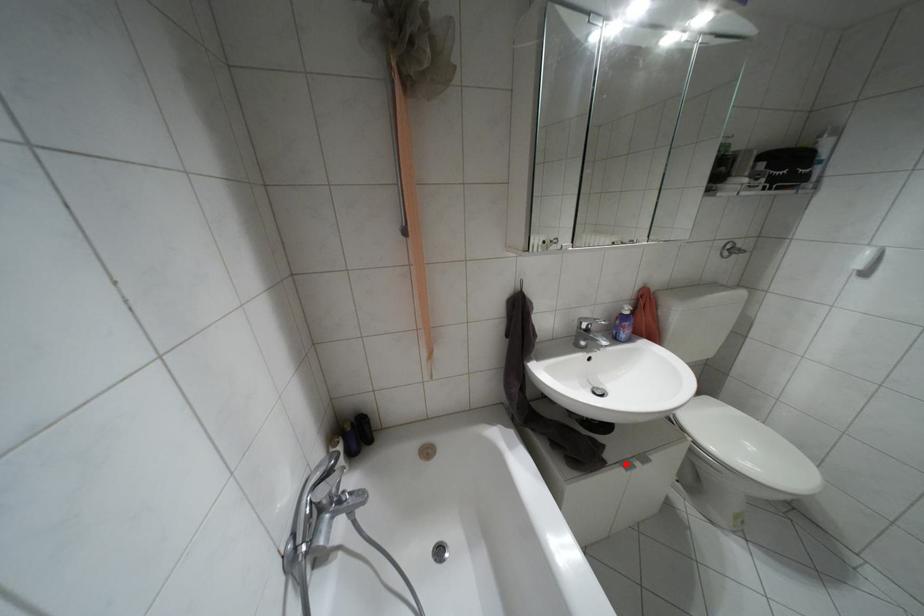
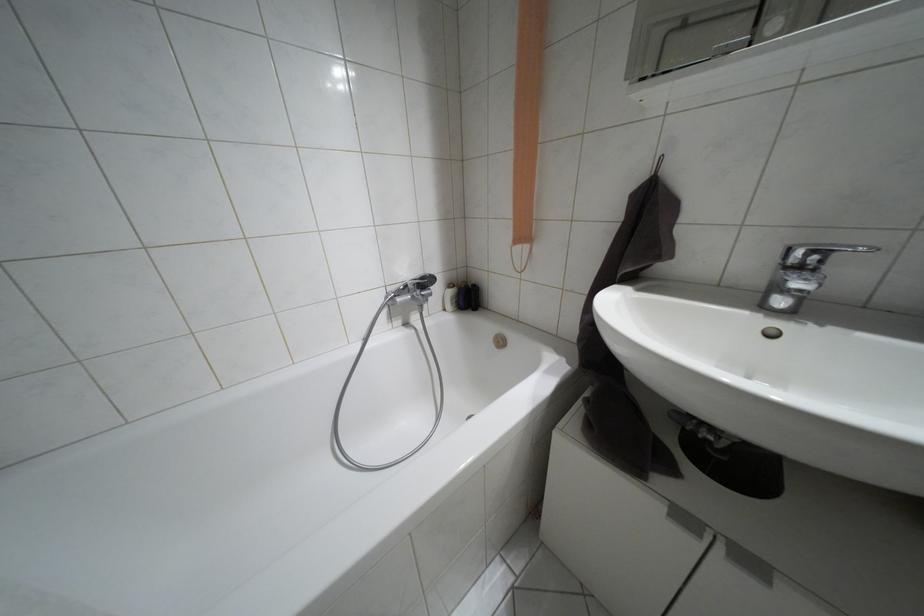
Question: I am providing you with two images of the same scene from different viewpoints. A red point is marked on the first image. Is the red point's position out of view in image 2?

Choices:
 (A) Yes
 (B) No

Answer: (B)